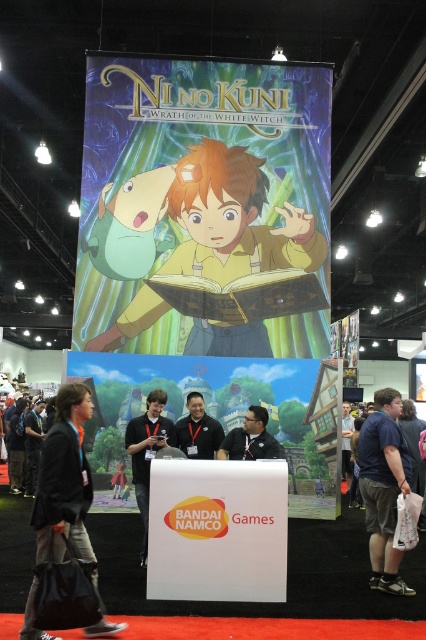
Question: Which object is closer to the camera taking this photo?

Choices:
 (A) matte yellow shirt at center
 (B) matte black shirt at center
 (C) dark blue shirt at center

Answer: (B)

Question: Estimate the real-world distances between objects in this image. Which object is farther from the dark blue shirt at center?

Choices:
 (A) black fabric jacket at lower left
 (B) matte yellow shirt at center

Answer: (A)

Question: Observing the image, what is the correct spatial positioning of dark blue shirt at lower right in reference to black fabric shirt at center?

Choices:
 (A) right
 (B) left

Answer: (A)

Question: Is matte yellow shirt at center positioned behind dark blue shirt at lower right?

Choices:
 (A) yes
 (B) no

Answer: (A)

Question: Can you confirm if matte yellow shirt at center is positioned below dark blue shirt at lower right?

Choices:
 (A) no
 (B) yes

Answer: (A)

Question: Which point is farther from the camera taking this photo?

Choices:
 (A) (126, 428)
 (B) (399, 467)
 (C) (86, 476)
 (D) (232, 321)

Answer: (D)